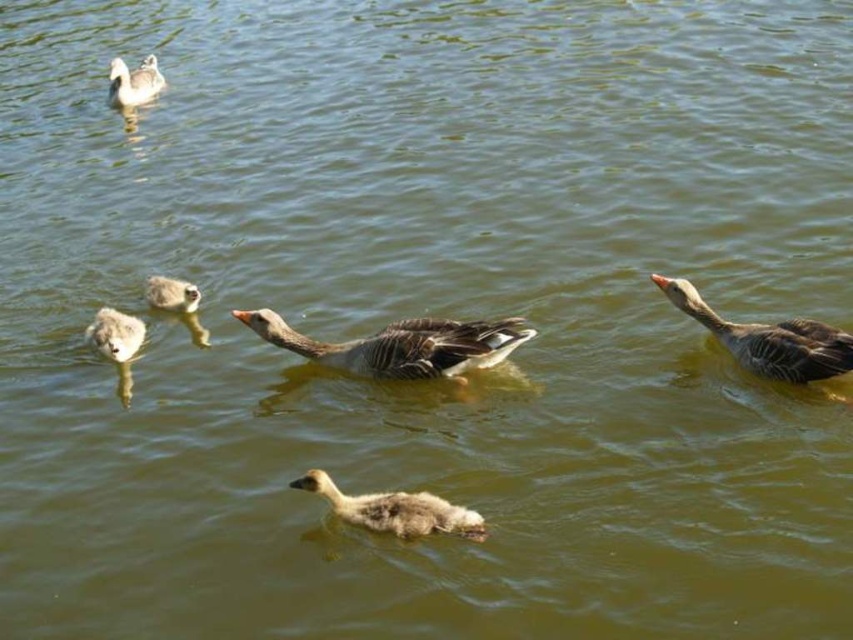
Does point (383, 369) come closer to viewer compared to point (173, 305)?

Yes.

Which of these two, gray matte duck at center or gray downy duckling at upper left, stands taller?

gray matte duck at center is taller.

I want to click on gray matte duck at center, so click(x=401, y=346).

You are a GUI agent. You are given a task and a screenshot of the screen. Output one action in this format:
    pyautogui.click(x=<x>, y=<y>)
    Task: Click on the speckled downy duckling at center
    The width and height of the screenshot is (853, 640).
    Given the screenshot: What is the action you would take?
    pyautogui.click(x=393, y=509)

Does speckled downy duckling at center have a smaller size compared to gray matte duckling at upper left?

Yes, speckled downy duckling at center is smaller than gray matte duckling at upper left.

Which is behind, point (421, 496) or point (126, 74)?

The point (126, 74) is more distant.

You are a GUI agent. You are given a task and a screenshot of the screen. Output one action in this format:
    pyautogui.click(x=<x>, y=<y>)
    Task: Click on the speckled downy duckling at center
    The height and width of the screenshot is (640, 853).
    Given the screenshot: What is the action you would take?
    pyautogui.click(x=393, y=509)

Which is behind, point (120, 83) or point (157, 282)?

The point (120, 83) is more distant.

Describe the element at coordinates (132, 83) in the screenshot. I see `gray matte duckling at upper left` at that location.

What do you see at coordinates (132, 83) in the screenshot? The width and height of the screenshot is (853, 640). I see `gray matte duckling at upper left` at bounding box center [132, 83].

The height and width of the screenshot is (640, 853). What are the coordinates of `gray matte duckling at upper left` in the screenshot? It's located at (132, 83).